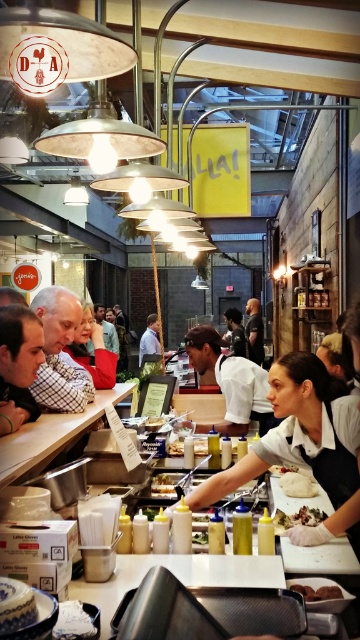
You are standing at the entrance of the food market and see the point marked at coordinates (51,435). What object does this point correspond to?

The point at coordinates (51,435) corresponds to the white glossy table at lower left.

You are standing at the entrance of the food market and want to take a photo of the counter where the woman is preparing food. The counter is located at point (101, 378). If your camera has a focal length of 50mm and you want to ensure the counter fills the frame, will you need to move closer or farther away?

The point (101, 378) is 3.67 meters from the camera. To fill the frame with the counter at this distance using a 50mm lens, you would need to move closer because the current distance may not be sufficient to capture the desired composition.